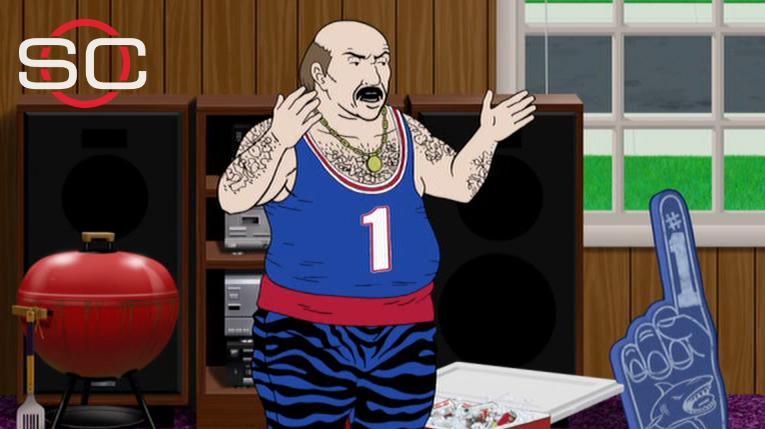
Identify the location of glass. (694, 165), (601, 183), (581, 66), (691, 70), (747, 67), (752, 177), (760, 6), (648, 18), (575, 18).